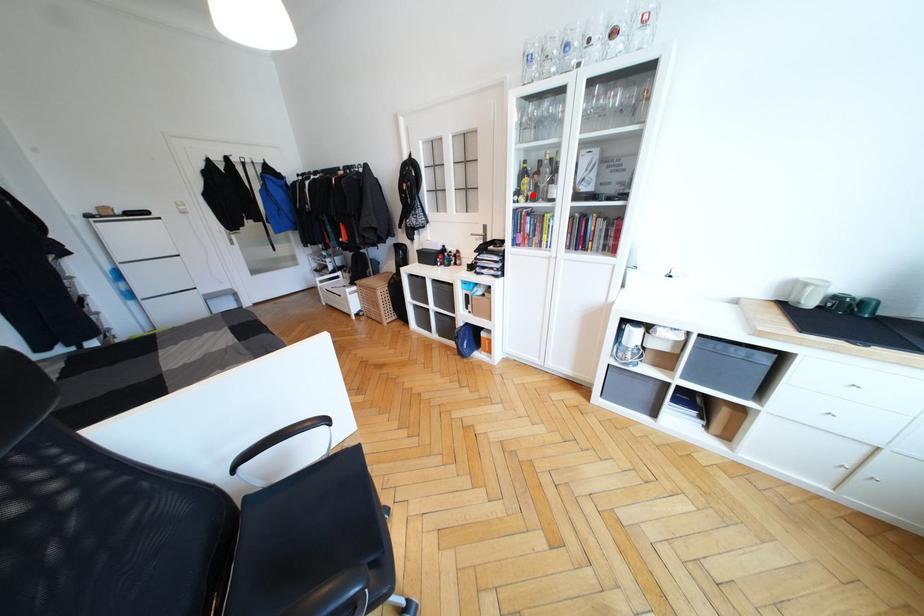
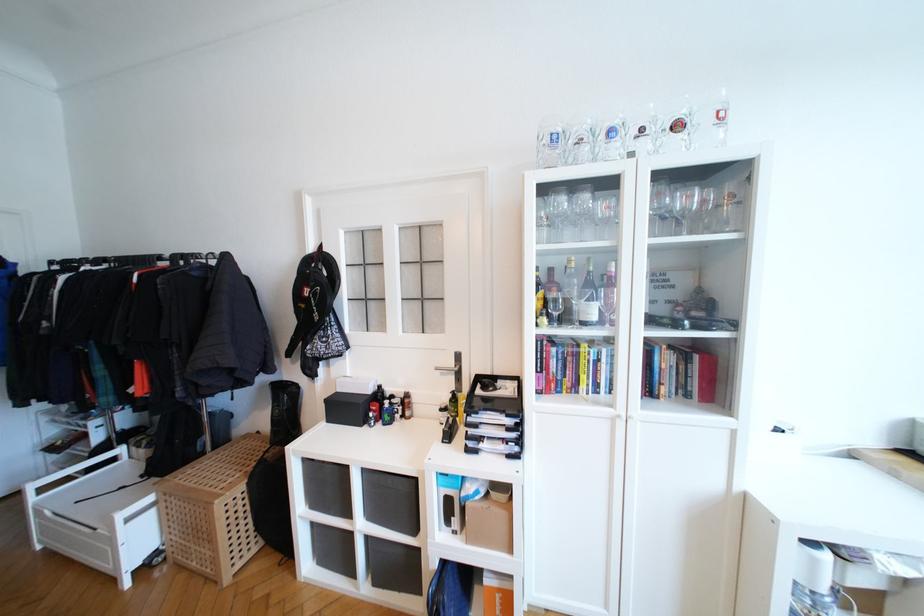
The point at the highlighted location is marked in the first image. Where is the corresponding point in the second image?

(558, 315)